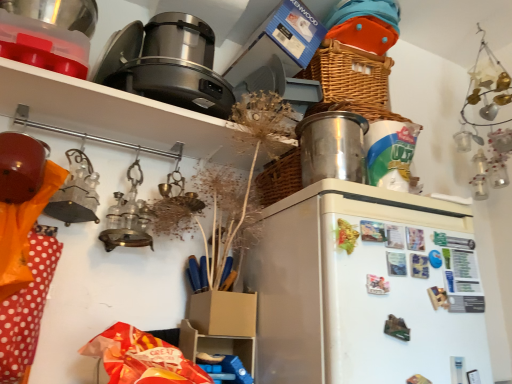
Question: Looking at their shapes, would you say satin silver appliance at upper center, which appears as the second appliance when viewed from the right, is wider or thinner than matte black pot at upper left?

Choices:
 (A) wide
 (B) thin

Answer: (B)

Question: From the image's perspective, relative to matte black pot at upper left, is satin silver appliance at upper center, which appears as the second appliance when viewed from the right, above or below?

Choices:
 (A) above
 (B) below

Answer: (A)

Question: Which object is the farthest from the shiny metallic container at upper right, the second appliance from the top?

Choices:
 (A) satin silver appliance at upper center, marked as the 1th appliance in a top-to-bottom arrangement
 (B) white matte refrigerator at center
 (C) matte black pot at upper left

Answer: (A)

Question: Which is farther from the matte black pot at upper left?

Choices:
 (A) shiny metallic container at upper right, the first appliance when ordered from right to left
 (B) satin silver appliance at upper center, marked as the 1th appliance in a top-to-bottom arrangement
 (C) white matte refrigerator at center

Answer: (C)